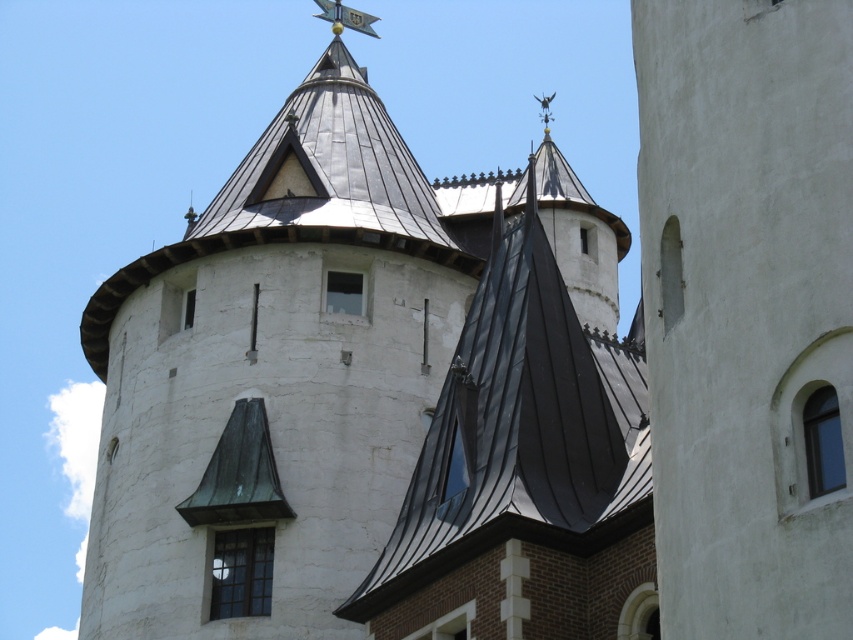
Is white smooth wall at right bigger than black metal roof at center?

No.

Does white smooth wall at right come in front of black metal roof at center?

Yes, white smooth wall at right is in front of black metal roof at center.

Image resolution: width=853 pixels, height=640 pixels. I want to click on white smooth wall at right, so click(x=747, y=310).

Find the location of `white smooth wall at right`. white smooth wall at right is located at coordinates (747, 310).

Does white stone tower at center have a smaller size compared to black metal roof at center?

No.

How distant is white stone tower at center from black metal roof at center?

They are 10.71 feet apart.

Is point (569, 577) farther from viewer compared to point (611, 561)?

Yes, it is behind point (611, 561).

Find the location of a particular element. This screenshot has height=640, width=853. white stone tower at center is located at coordinates (370, 400).

At what (x,y) coordinates should I click in order to perform the action: click on white stone tower at center. Please return your answer as a coordinate pair (x, y). The width and height of the screenshot is (853, 640). Looking at the image, I should click on (370, 400).

Who is more forward, (519, 406) or (660, 387)?

Point (660, 387) is in front.

Who is more forward, [219,216] or [656,288]?

Point [656,288]

At what (x,y) coordinates should I click in order to perform the action: click on white stone tower at center. Please return your answer as a coordinate pair (x, y). This screenshot has height=640, width=853. Looking at the image, I should click on (370, 400).